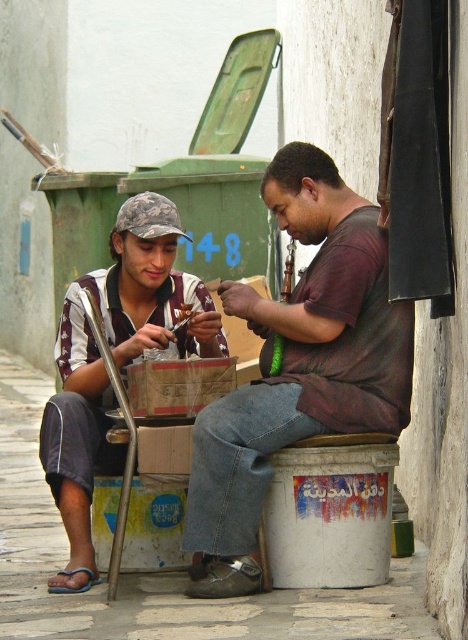
Question: Is dark brown leather shirt at center to the right of camouflage fabric cap at left from the viewer's perspective?

Choices:
 (A) no
 (B) yes

Answer: (B)

Question: Does dark brown leather shirt at center appear under camouflage fabric cap at left?

Choices:
 (A) yes
 (B) no

Answer: (B)

Question: Which object appears farthest from the camera in this image?

Choices:
 (A) dark brown leather shirt at center
 (B) camouflage fabric cap at left

Answer: (B)

Question: Does dark brown leather shirt at center appear under camouflage fabric cap at left?

Choices:
 (A) yes
 (B) no

Answer: (B)

Question: Which point is closer to the camera taking this photo?

Choices:
 (A) (222, 532)
 (B) (110, 269)

Answer: (A)